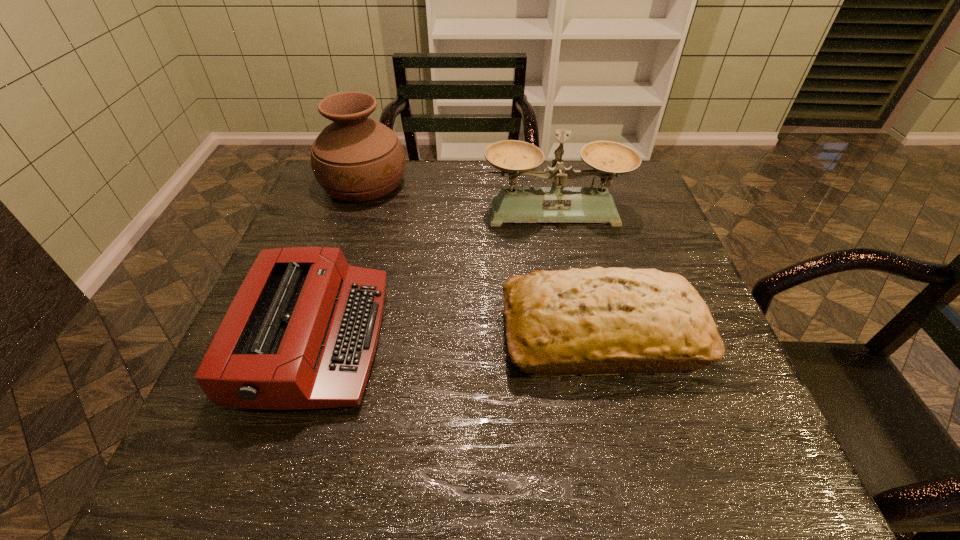
This screenshot has width=960, height=540. What are the coordinates of `urn that is at the left edge` in the screenshot? It's located at (355, 158).

Identify the location of typewriter present at the left edge. This screenshot has height=540, width=960. (301, 333).

Where is `scale that is at the right edge`? scale that is at the right edge is located at coordinates (557, 204).

Find the location of a particular element. Image resolution: width=960 pixels, height=540 pixels. bread present at the right edge is located at coordinates (595, 321).

Where is `object located in the far left corner section of the desktop`? The height and width of the screenshot is (540, 960). object located in the far left corner section of the desktop is located at coordinates (355, 158).

Find the location of a particular element. Image resolution: width=960 pixels, height=540 pixels. object that is positioned at the far right corner is located at coordinates (557, 204).

This screenshot has width=960, height=540. In the image, there is a desktop. Identify the location of vacant space at the far edge. coord(438,178).

You are a GUI agent. You are given a task and a screenshot of the screen. Output one action in this format:
    pyautogui.click(x=<x>, y=<y>)
    Task: Click on the free space at the left edge
    The height and width of the screenshot is (540, 960).
    Given the screenshot: What is the action you would take?
    pyautogui.click(x=358, y=220)

The width and height of the screenshot is (960, 540). Find the location of `vacant space at the right edge of the desktop`. vacant space at the right edge of the desktop is located at coordinates (740, 403).

I want to click on vacant space at the near left corner, so click(x=193, y=455).